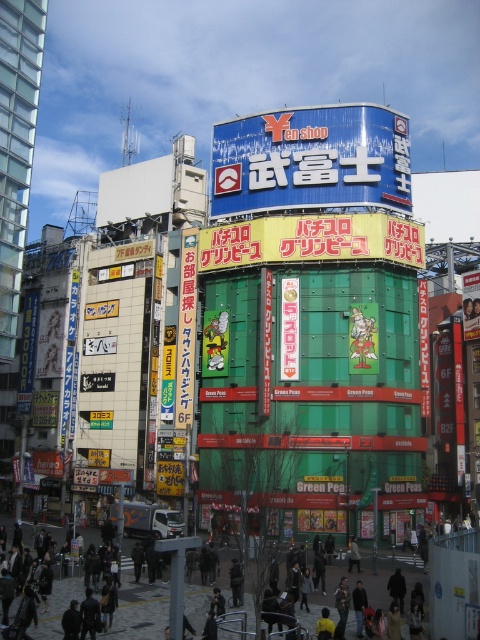
Question: Can you confirm if yellow plastic sign at center is positioned to the right of green matte sign at center?

Choices:
 (A) no
 (B) yes

Answer: (B)

Question: Estimate the real-world distances between objects in this image. Which object is closer to the green matte sign at center?

Choices:
 (A) yellow plastic sign at center
 (B) dark gray jacket at center

Answer: (B)

Question: Is blue glossy sign at upper center further to camera compared to yellow plastic sign at center?

Choices:
 (A) yes
 (B) no

Answer: (A)

Question: Which object is positioned farthest from the blue glossy sign at upper center?

Choices:
 (A) dark gray jacket at center
 (B) yellow plastic sign at center
 (C) green matte sign at center

Answer: (A)

Question: Which object appears closest to the camera in this image?

Choices:
 (A) yellow plastic sign at center
 (B) green matte sign at center
 (C) blue glossy sign at upper center
 (D) dark gray jacket at center

Answer: (D)

Question: Is dark gray jacket at center positioned before yellow plastic sign at center?

Choices:
 (A) no
 (B) yes

Answer: (B)